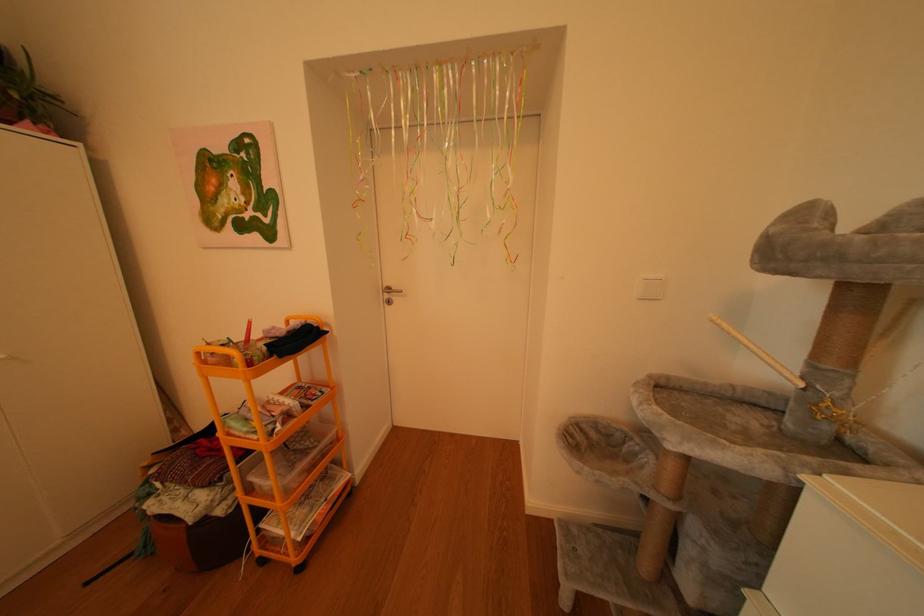
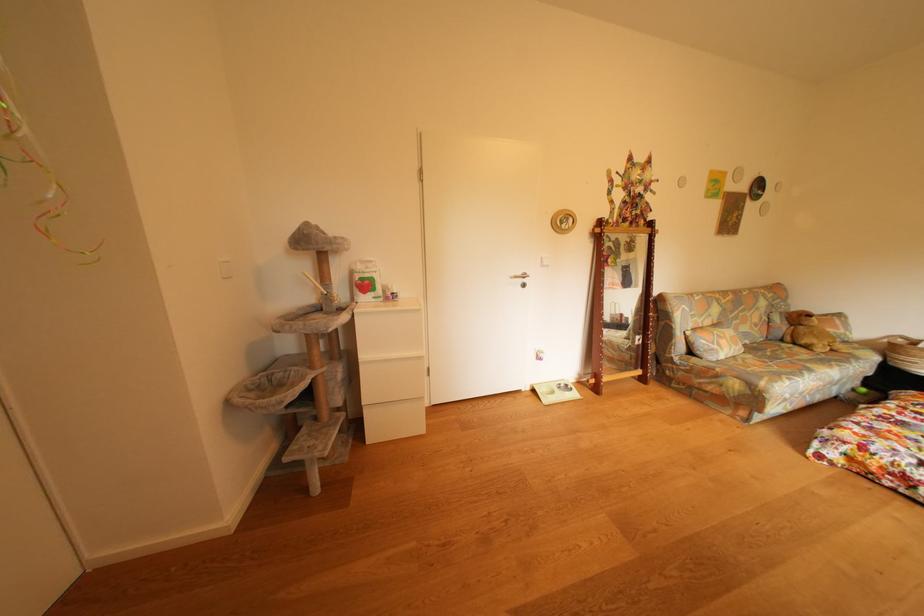
Consider the image. The images are taken continuously from a first-person perspective. In which direction is your viewpoint rotating?

The camera rotated toward right-down.